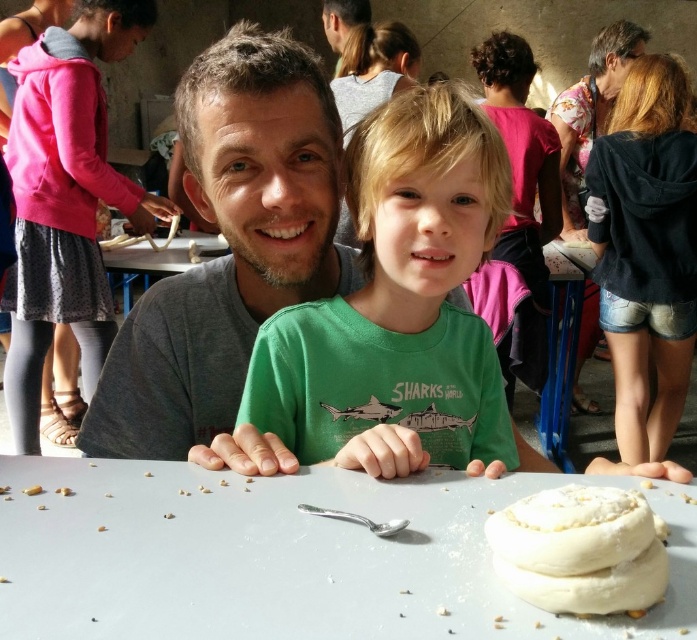
Which is more to the right, white doughnut at center or pink fabric at upper center?

Positioned to the right is pink fabric at upper center.

Based on the photo, does white doughnut at center have a lesser height compared to pink fabric at upper center?

Correct, white doughnut at center is not as tall as pink fabric at upper center.

What do you see at coordinates (579, 548) in the screenshot? The width and height of the screenshot is (697, 640). I see `white doughnut at center` at bounding box center [579, 548].

This screenshot has width=697, height=640. In order to click on white doughnut at center in this screenshot , I will do `click(579, 548)`.

Measure the distance from green matte shirt at center to pink fabric at upper center.

4.50 feet

Is green matte shirt at center bigger than pink fabric at upper center?

Incorrect, green matte shirt at center is not larger than pink fabric at upper center.

This screenshot has width=697, height=640. Identify the location of green matte shirt at center. (x=422, y=202).

Which is below, white matte table at center or green matte shirt at center?

Positioned lower is white matte table at center.

Can you confirm if white matte table at center is taller than green matte shirt at center?

In fact, white matte table at center may be shorter than green matte shirt at center.

Where is `white matte table at center`? white matte table at center is located at coordinates (284, 556).

What are the coordinates of `white matte table at center` in the screenshot? It's located at (284, 556).